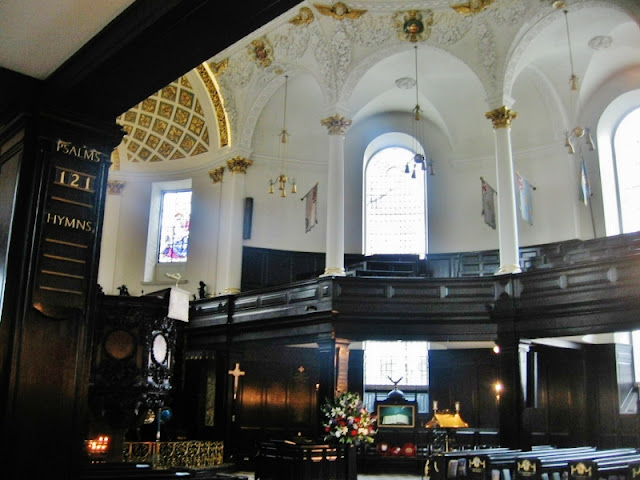
I want to click on pews, so click(604, 464), click(552, 462), click(493, 458).